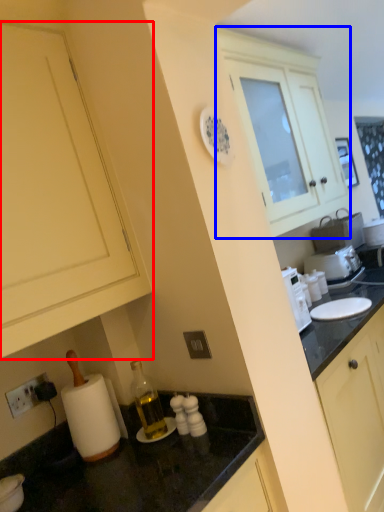
Question: Which object is closer to the camera taking this photo, cabinetry (highlighted by a red box) or cabinetry (highlighted by a blue box)?

Choices:
 (A) cabinetry
 (B) cabinetry

Answer: (A)